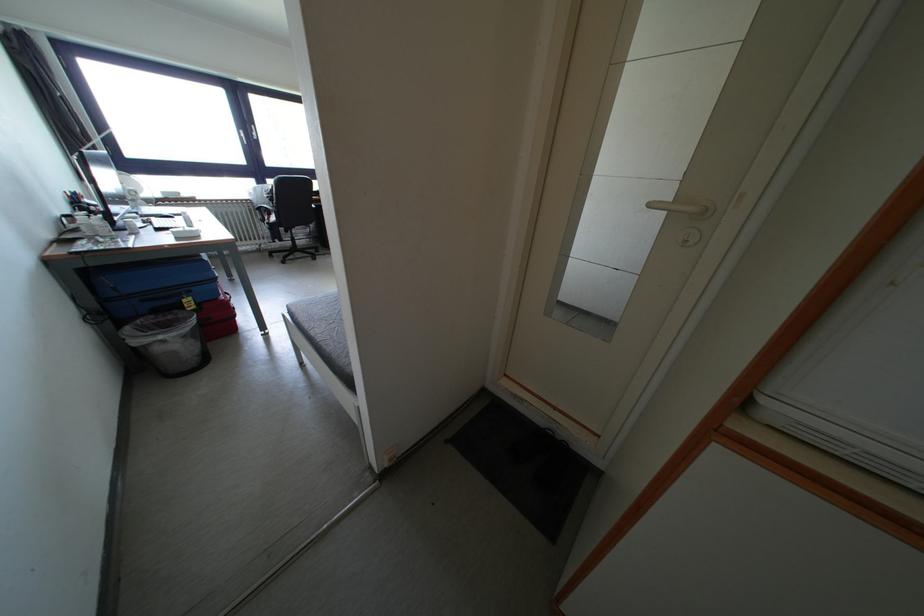
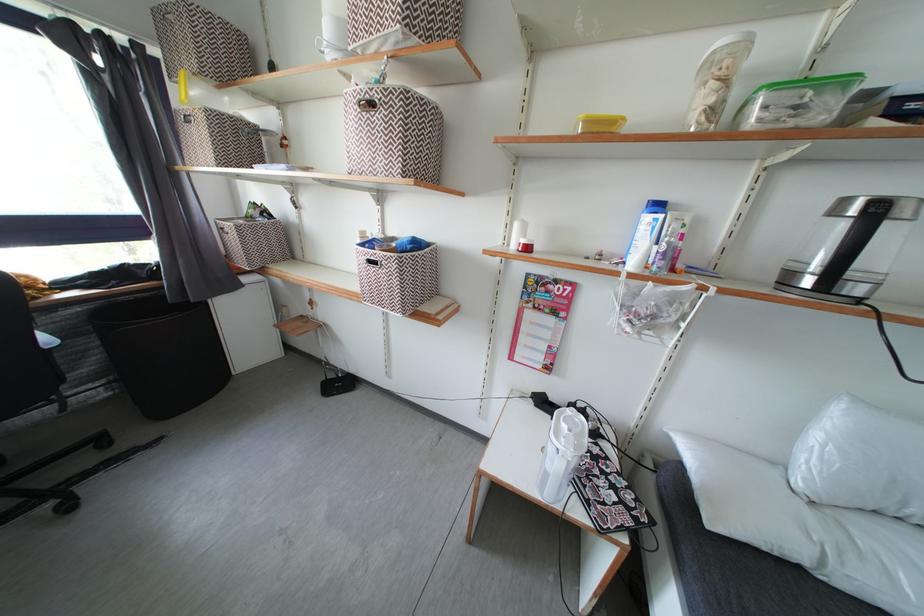
Which direction would the cameraman need to move to produce the second image?

The cameraman moved toward left, forward.